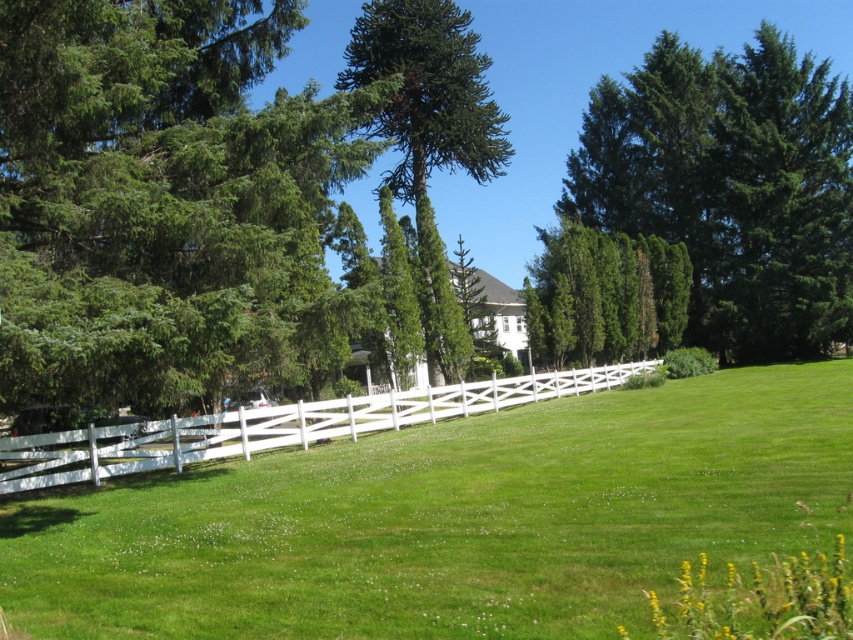
Consider the image. You are standing in the middle of the lawn and see the green textured tree at upper right and the white wooden fence at lower center. Which object is positioned to the right of the other?

The green textured tree at upper right is positioned to the right of the white wooden fence at lower center.

What is the spatial relationship between the green grassy field at center and the green textured hedge at center in the scene?

The green grassy field at center is closer to the viewer than the green textured hedge at center.

From the picture: You are a gardener planning to mow the green grassy field at center and trim the green textured hedge at center. Which area requires more horizontal space to work on?

The green grassy field at center might be wider than green textured hedge at center, so it requires more horizontal space to work on.